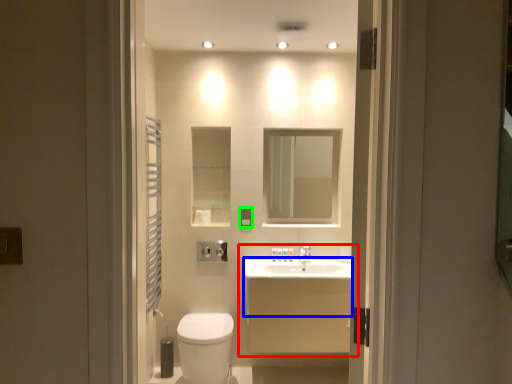
Question: Which object is the farthest from bathroom cabinet (highlighted by a red box)? Choose among these: counter top (highlighted by a blue box) or electric outlet (highlighted by a green box).

Choices:
 (A) counter top
 (B) electric outlet

Answer: (B)